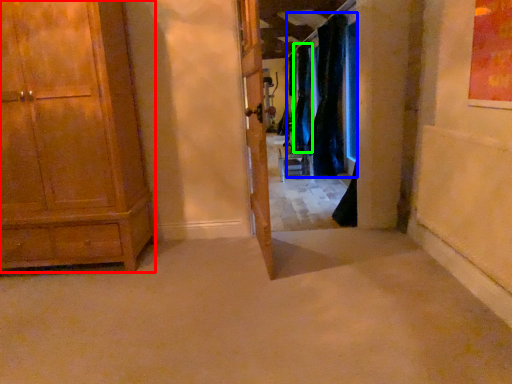
Question: Which object is positioned closest to cabinetry (highlighted by a red box)? Select from curtain (highlighted by a blue box) and curtain (highlighted by a green box).

Choices:
 (A) curtain
 (B) curtain

Answer: (A)